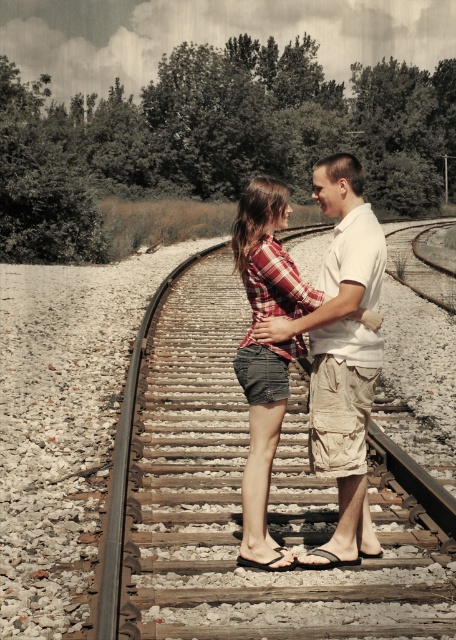
The width and height of the screenshot is (456, 640). Find the location of `wooden planks at center`. wooden planks at center is located at coordinates (233, 488).

Image resolution: width=456 pixels, height=640 pixels. I want to click on wooden planks at center, so click(x=233, y=488).

Can you confirm if wooden planks at center is bigger than white cotton shirt at center?

Yes, wooden planks at center is bigger than white cotton shirt at center.

Is point (207, 634) behind point (326, 442)?

That is False.

At what (x,y) coordinates should I click in order to perform the action: click on wooden planks at center. Please return your answer as a coordinate pair (x, y). Looking at the image, I should click on (233, 488).

Is white cotton shirt at center in front of plaid fabric shorts at center?

Yes, it is in front of plaid fabric shorts at center.

Measure the distance between white cotton shirt at center and camera.

A distance of 11.97 feet exists between white cotton shirt at center and camera.

Which is in front, point (342, 499) or point (279, 406)?

Positioned in front is point (342, 499).

Where is `white cotton shirt at center`? The width and height of the screenshot is (456, 640). white cotton shirt at center is located at coordinates (342, 355).